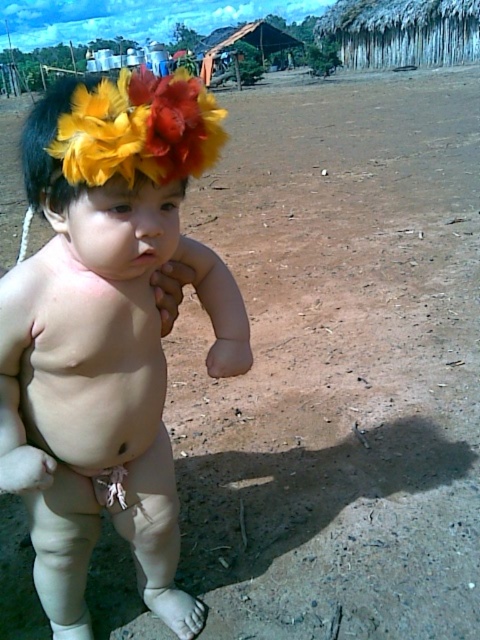
Does pink smooth skin at center have a lesser height compared to feathered headband at upper center?

Correct, pink smooth skin at center is not as tall as feathered headband at upper center.

The width and height of the screenshot is (480, 640). What do you see at coordinates (90, 364) in the screenshot? I see `pink smooth skin at center` at bounding box center [90, 364].

Where is `pink smooth skin at center`? pink smooth skin at center is located at coordinates (90, 364).

Looking at this image, can you confirm if fluffy fabric flower at center is bigger than pink smooth skin at center?

Yes.

Is fluffy fabric flower at center above pink smooth skin at center?

Incorrect, fluffy fabric flower at center is not positioned above pink smooth skin at center.

Which is behind, point (67, 452) or point (108, 308)?

Positioned behind is point (67, 452).

Find the location of a particular element. fluffy fabric flower at center is located at coordinates (107, 330).

Which is in front, point (134, 410) or point (118, 502)?

Point (134, 410)

Does pink smooth skin at center have a larger size compared to white cloth diaper at lower center?

Yes, pink smooth skin at center is bigger than white cloth diaper at lower center.

Locate an element on the screen. pink smooth skin at center is located at coordinates (90, 364).

The image size is (480, 640). In order to click on pink smooth skin at center in this screenshot , I will do `click(90, 364)`.